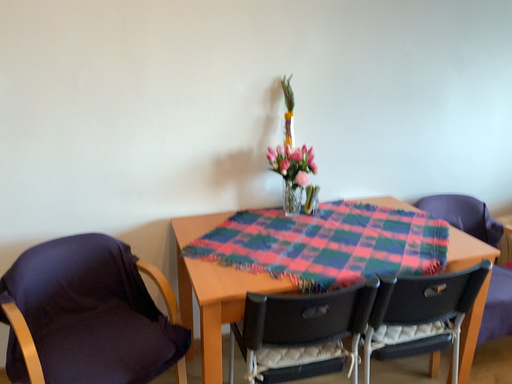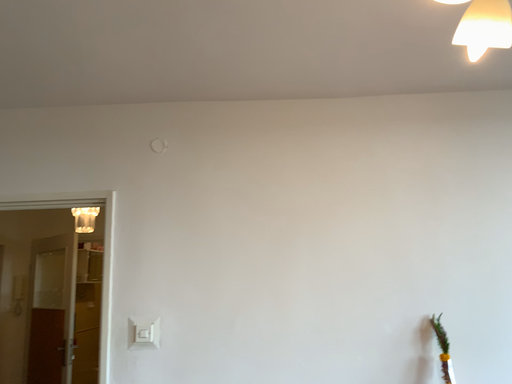
Question: How did the camera likely rotate when shooting the video?

Choices:
 (A) rotated upward
 (B) rotated downward

Answer: (A)